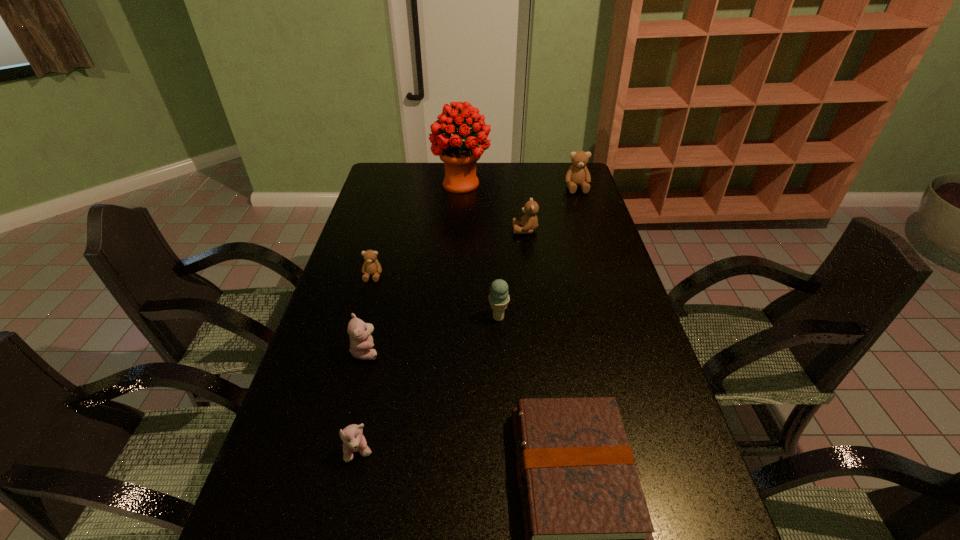
At what (x,y) coordinates should I click in order to perform the action: click on bouquet. Please return your answer as a coordinate pair (x, y). Image resolution: width=960 pixels, height=540 pixels. Looking at the image, I should click on (460, 157).

Where is `the tallest teddy bear`? The height and width of the screenshot is (540, 960). the tallest teddy bear is located at coordinates (x=577, y=175).

Where is `the rightmost object`? The image size is (960, 540). the rightmost object is located at coordinates (577, 175).

Identify the location of ice cream. This screenshot has width=960, height=540. (499, 298).

At what (x,y) coordinates should I click in order to perform the action: click on the fourth nearest object. Please return your answer as a coordinate pair (x, y). This screenshot has height=540, width=960. Looking at the image, I should click on (499, 298).

Where is `the fourth teddy bear from left to right`? This screenshot has height=540, width=960. the fourth teddy bear from left to right is located at coordinates (529, 222).

At what (x,y) coordinates should I click in order to perform the action: click on the second biggest brown teddy bear. Please return your answer as a coordinate pair (x, y). The width and height of the screenshot is (960, 540). Looking at the image, I should click on (529, 222).

Locate an element on the screen. This screenshot has height=540, width=960. the second nearest teddy bear is located at coordinates (361, 342).

Identify the location of the bigger pink teddy bear. The width and height of the screenshot is (960, 540). (361, 342).

Identify the location of the smallest brown teddy bear. (371, 266).